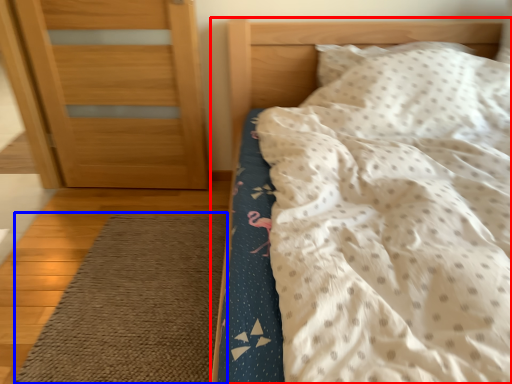
Question: Among these objects, which one is farthest to the camera, bed (highlighted by a red box) or doormat (highlighted by a blue box)?

Choices:
 (A) bed
 (B) doormat

Answer: (B)